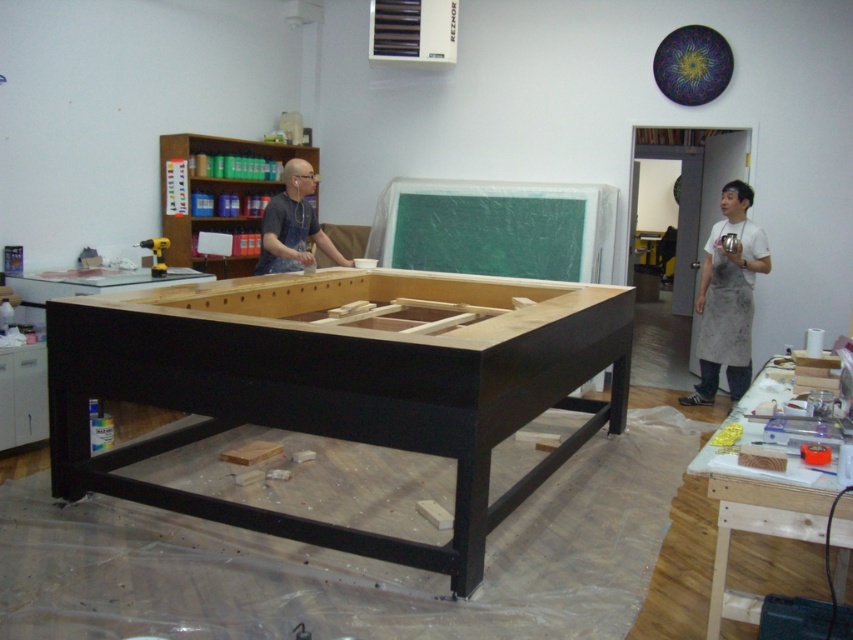
Is point (747, 320) farther from viewer compared to point (161, 266)?

Yes.

Which is more to the right, white apron at right or metallic yellow drill at left?

Positioned to the right is white apron at right.

Find the location of a particular element. white apron at right is located at coordinates (727, 298).

Between point (749, 490) and point (271, 225), which one is positioned in front?

Positioned in front is point (749, 490).

The image size is (853, 640). Describe the element at coordinates (756, 525) in the screenshot. I see `wooden at center` at that location.

The width and height of the screenshot is (853, 640). I want to click on wooden at center, so click(756, 525).

Between wooden at center and white apron at right, which one is positioned lower?

wooden at center

Between point (805, 534) and point (746, 276), which one is positioned in front?

Positioned in front is point (805, 534).

Is point (773, 388) farther from viewer compared to point (762, 253)?

No, (773, 388) is closer to viewer.

The image size is (853, 640). I want to click on wooden at center, so click(756, 525).